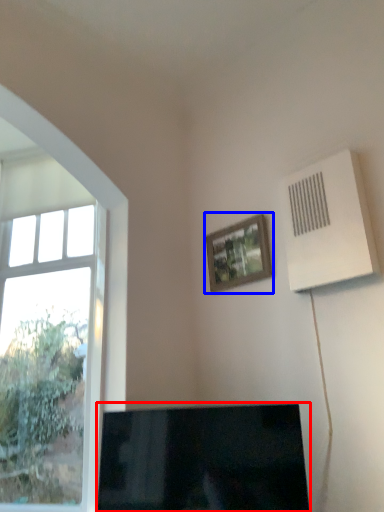
Question: Which object is closer to the camera taking this photo, television (highlighted by a red box) or picture frame (highlighted by a blue box)?

Choices:
 (A) television
 (B) picture frame

Answer: (A)